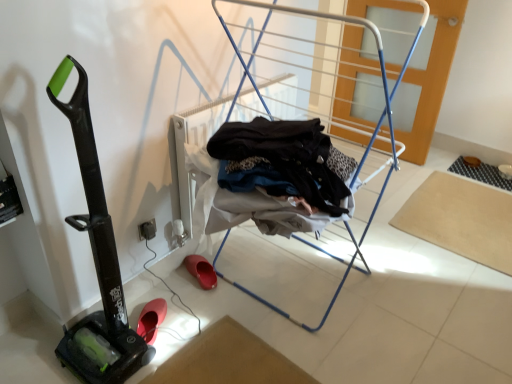
At what (x,y) coordinates should I click in order to perform the action: click on free space in front of rubber/soft sole shoe at lower left, which appears as the second footwear when viewed from the back. Please return your answer as a coordinate pair (x, y). Looking at the image, I should click on (162, 351).